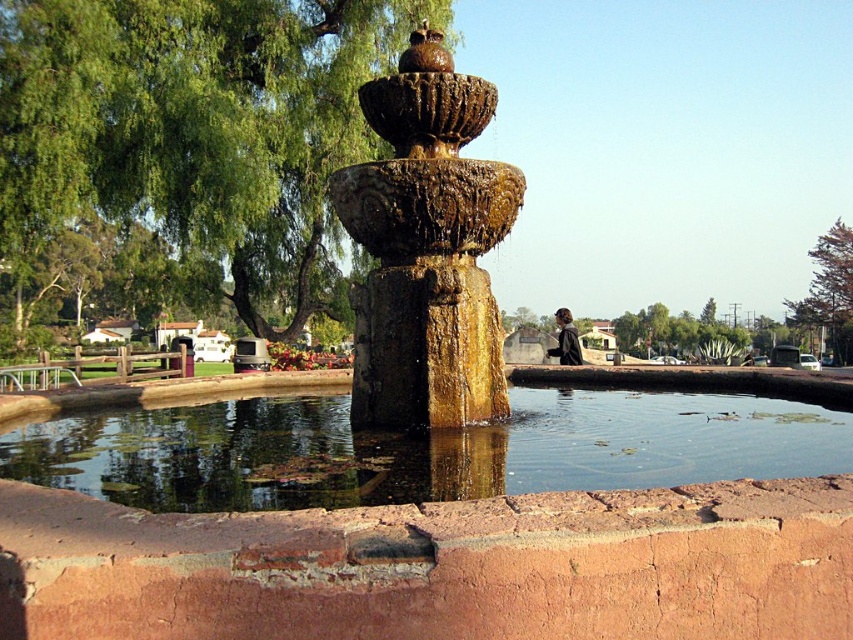
How much distance is there between green leafy tree at upper left and golden stone fountain at center?

green leafy tree at upper left is 19.81 meters away from golden stone fountain at center.

This screenshot has height=640, width=853. Describe the element at coordinates (183, 156) in the screenshot. I see `green leafy tree at upper left` at that location.

Is point (300, 221) farther from camera compared to point (399, 259)?

Yes, it is behind point (399, 259).

The image size is (853, 640). What are the coordinates of `green leafy tree at upper left` in the screenshot? It's located at (183, 156).

Is point (166, 186) positioned before point (845, 232)?

Yes, it is.

Who is shorter, green leafy tree at upper left or green leafy tree at upper right?

green leafy tree at upper right

Is point (86, 307) behind point (834, 317)?

No, (86, 307) is closer to viewer.

The image size is (853, 640). Find the location of `green leafy tree at upper left`. green leafy tree at upper left is located at coordinates (183, 156).

Is clear water at fountain center taller than golden stone fountain at center?

Incorrect, clear water at fountain center's height is not larger of golden stone fountain at center's.

What do you see at coordinates (419, 449) in the screenshot? I see `clear water at fountain center` at bounding box center [419, 449].

Where is `clear water at fountain center`? clear water at fountain center is located at coordinates (419, 449).